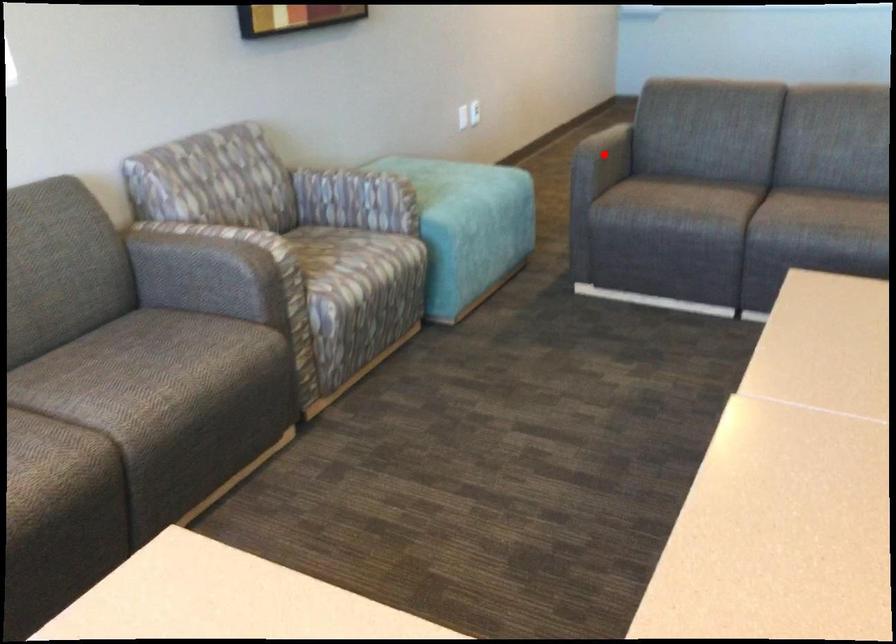
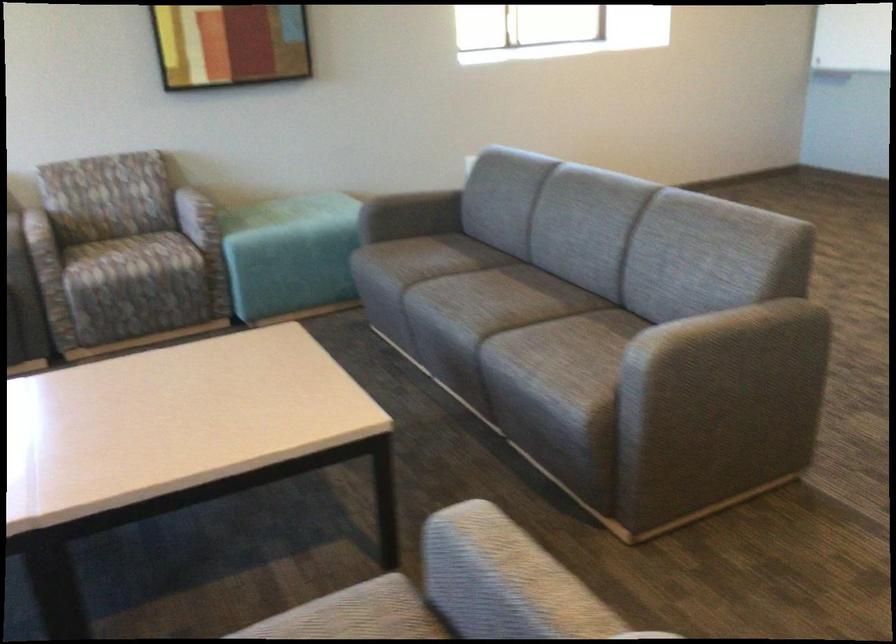
Question: I am providing you with two images of the same scene from different viewpoints. A red point is shown in image1. For the corresponding object point in image2, is it positioned nearer or farther from the camera?

Choices:
 (A) Nearer
 (B) Farther

Answer: (B)